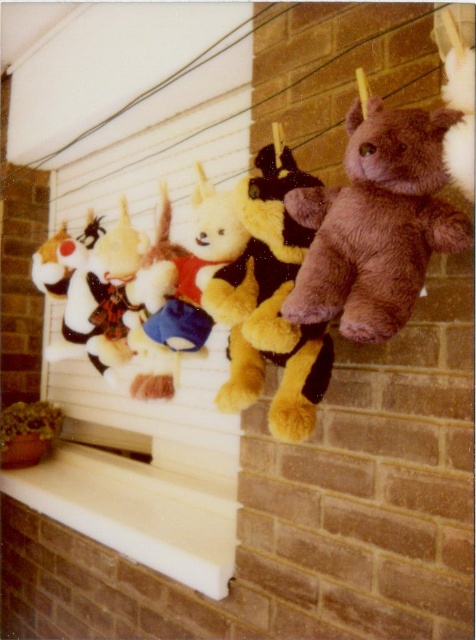
You are trying to place a small vase on the white smooth ledge at lower center. However, you notice the fuzzy brown teddy bear at center is nearby. Will the teddy bear block the vase from being placed on the ledge?

The white smooth ledge at lower center is not as tall as the fuzzy brown teddy bear at center, so the teddy bear is taller and might block the vase from being placed on the ledge.

You are organizing a toy display and need to place the brown plush bear at upper right and the white smooth ledge at lower center. Based on their sizes, which object can fit into a smaller storage container?

The brown plush bear at upper right occupies less space than the white smooth ledge at lower center, so it can fit into a smaller storage container.

You are a child trying to place a new plush toy on the ledge. The new toy is as wide as the brown plush bear at upper right. Will it fit on the white smooth ledge at lower center?

The brown plush bear at upper right has a lesser width compared to white smooth ledge at lower center, so the new toy will fit since it is narrower than the ledge.